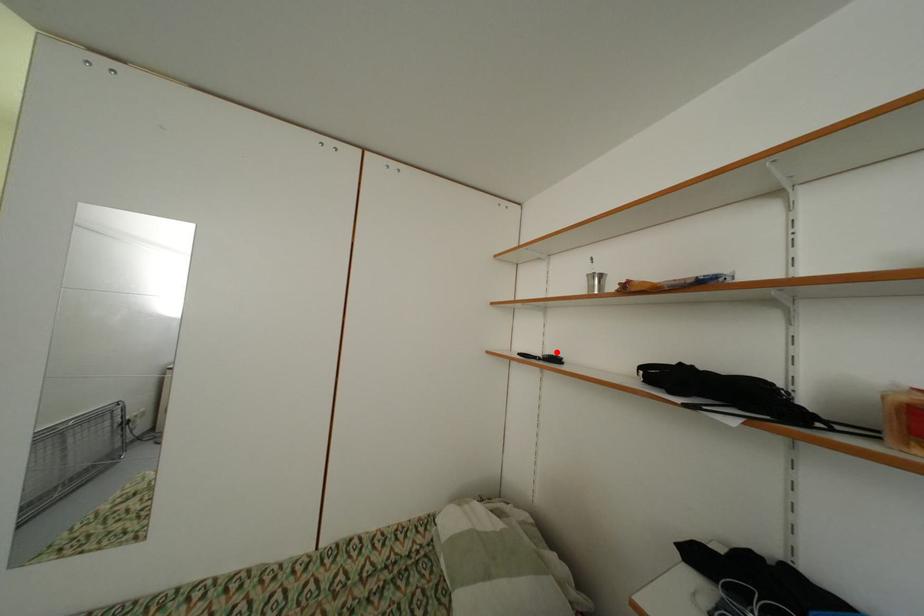
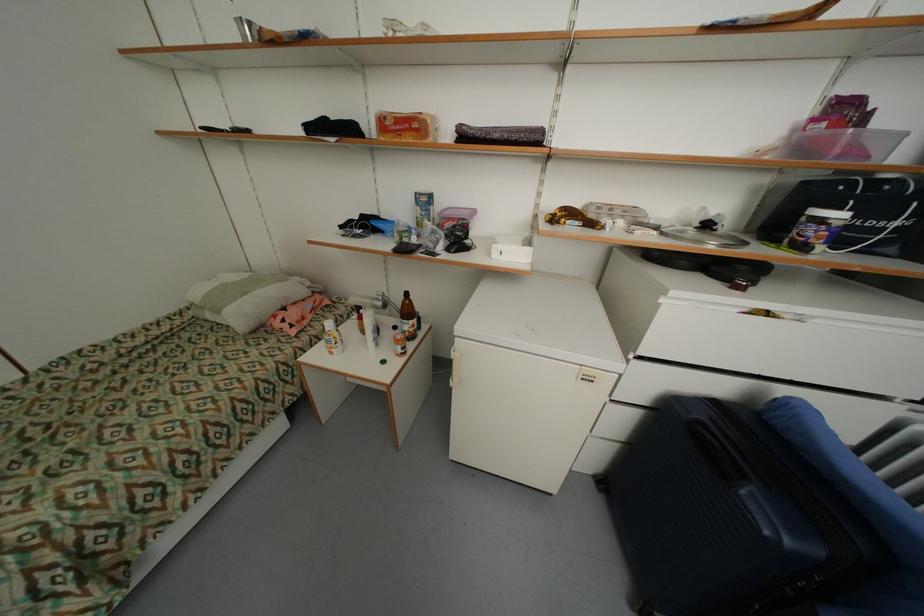
In the second image, find the point that corresponds to the highlighted location in the first image.

(248, 128)